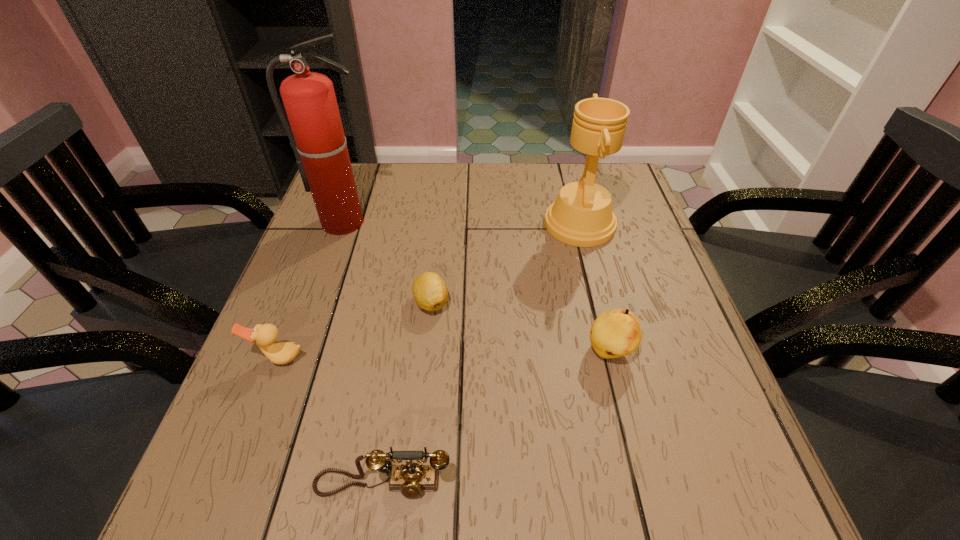
The image size is (960, 540). What are the coordinates of `fire extinguisher` in the screenshot? It's located at (316, 135).

I want to click on award, so point(582,216).

This screenshot has width=960, height=540. Find the location of `pear`. pear is located at coordinates (615, 333).

Image resolution: width=960 pixels, height=540 pixels. In order to click on telephone in this screenshot , I will do pyautogui.click(x=411, y=479).

Find the location of a particular element. The image size is (960, 540). duck is located at coordinates (265, 335).

Where is `the shortest object`? The image size is (960, 540). the shortest object is located at coordinates (429, 290).

At what (x,y) coordinates should I click in order to perform the action: click on the fourth nearest object. Please return your answer as a coordinate pair (x, y). The height and width of the screenshot is (540, 960). Looking at the image, I should click on (429, 290).

This screenshot has width=960, height=540. I want to click on vacant point located 0.390m with the nozzle and gauge on the tallest object, so pos(297,362).

Where is `vacant space positioned 0.060m on the left of the fifth shortest object`? The width and height of the screenshot is (960, 540). vacant space positioned 0.060m on the left of the fifth shortest object is located at coordinates (522, 225).

What are the coordinates of `free location located on the left of the pear` in the screenshot? It's located at (397, 352).